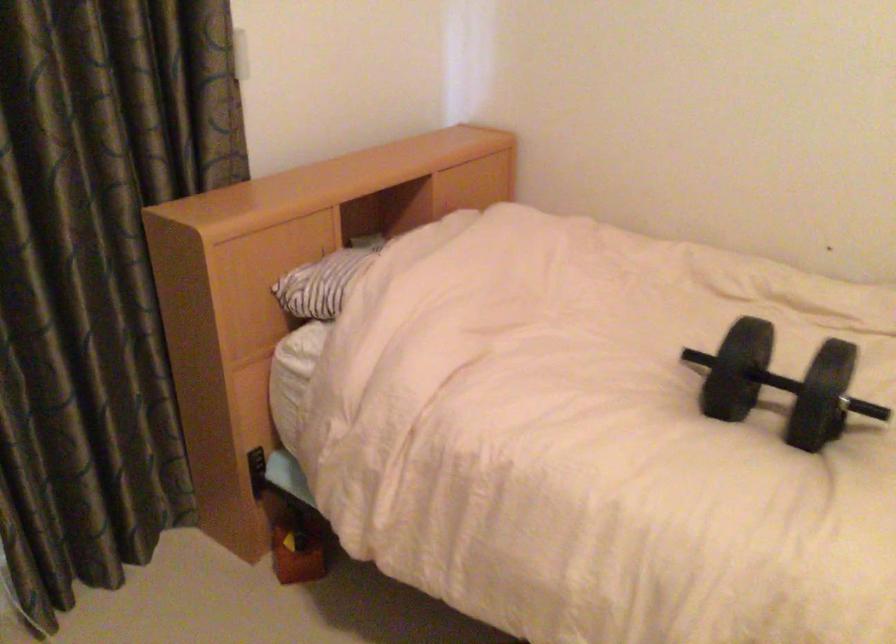
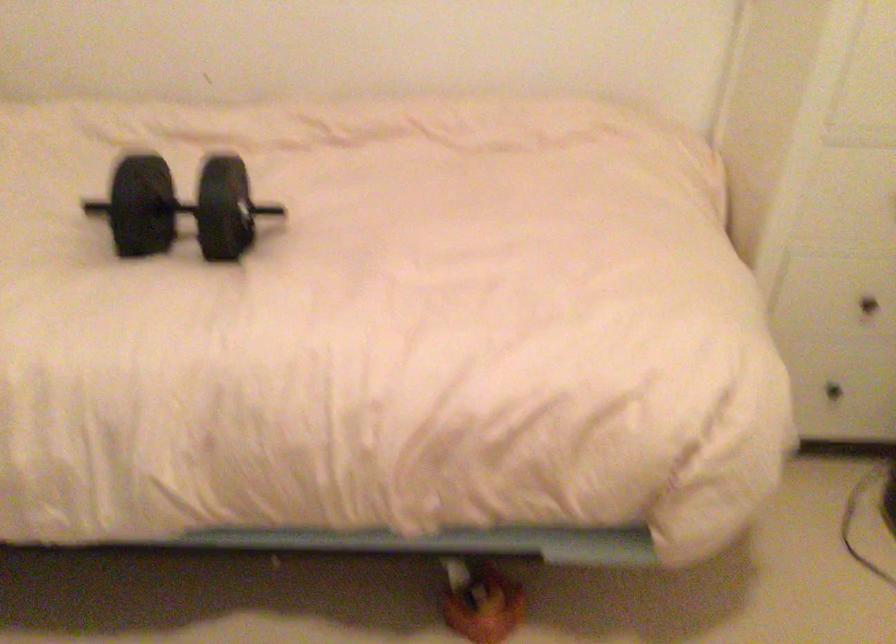
Question: The camera is either moving clockwise (left) or counter-clockwise (right) around the object. The first image is from the beginning of the video and the second image is from the end. Is the camera moving left or right when shooting the video?

Choices:
 (A) Left
 (B) Right

Answer: (A)